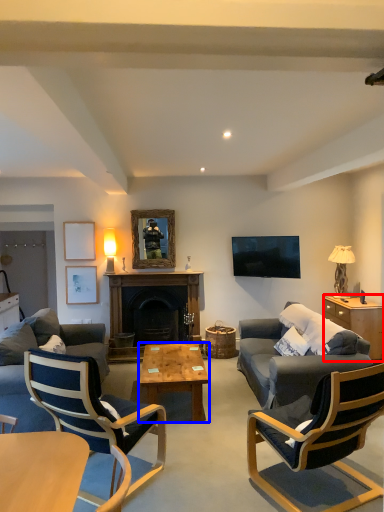
Question: Which object is further to the camera taking this photo, cabinetry (highlighted by a red box) or coffee table (highlighted by a blue box)?

Choices:
 (A) cabinetry
 (B) coffee table

Answer: (A)